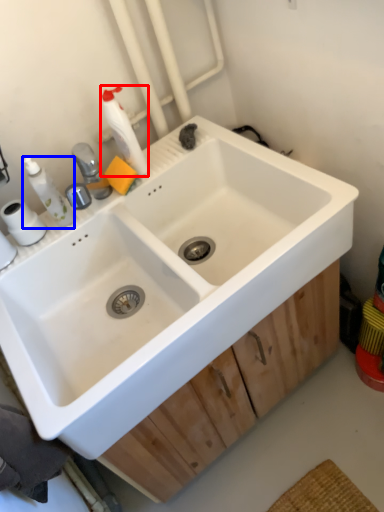
Question: Which object appears closest to the camera in this image, cleaning product (highlighted by a red box) or toiletry (highlighted by a blue box)?

Choices:
 (A) cleaning product
 (B) toiletry

Answer: (B)